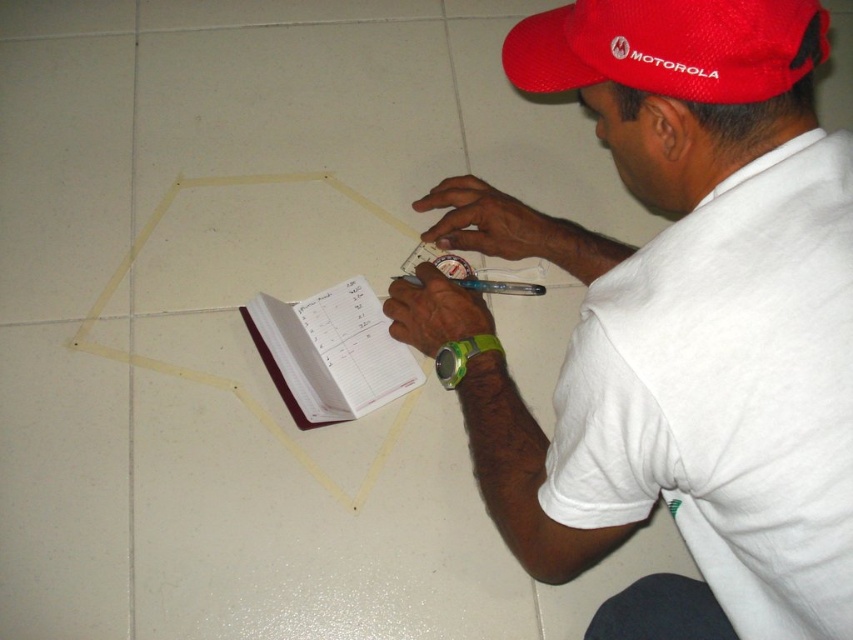
You are a safety inspector observing the scene. You notice the white matte shirt at center and the green rubber wristband at lower right. Which object is closer to you?

The white matte shirt at center is closer to the viewer than the green rubber wristband at lower right.

The user is trying to determine the spatial relationship between the white matte shirt at center and the green rubber wristband at lower right. Which object is positioned to the right of the other?

The white matte shirt at center is to the right of green rubber wristband at lower right.

You are a worker observing the scene. You notice the red mesh cap at upper center and the green rubber wristband at lower right. Which object is located higher in the image?

The red mesh cap at upper center is positioned over the green rubber wristband at lower right, so it is higher in the image.